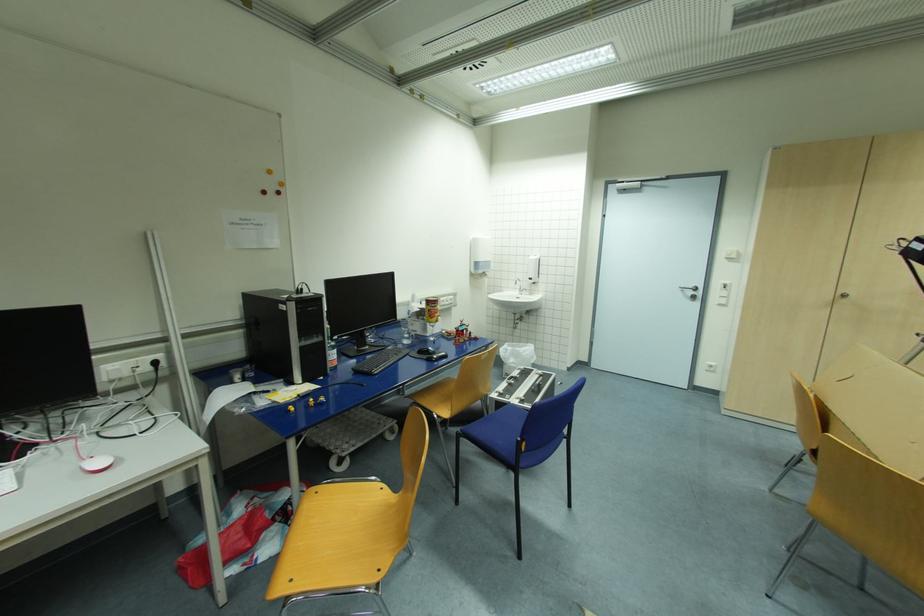
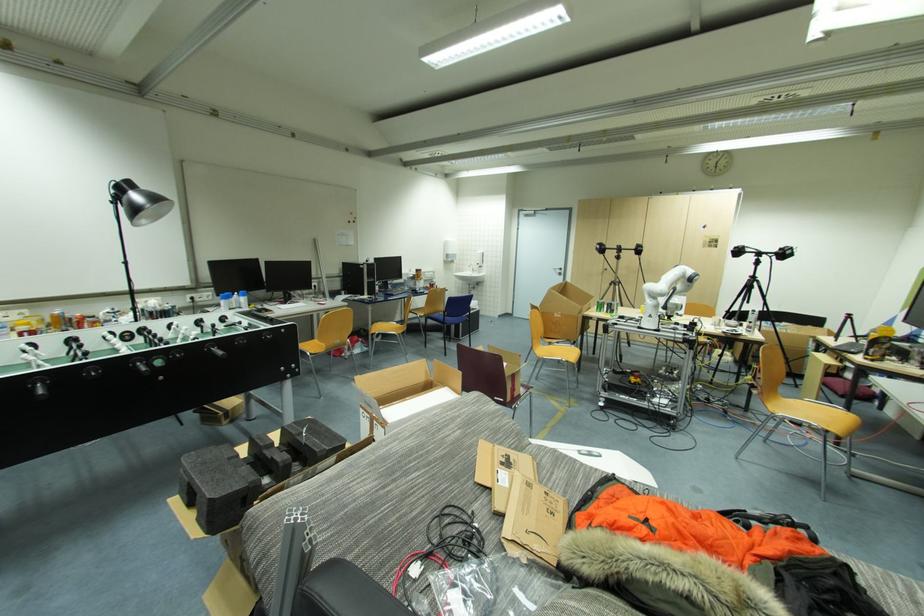
Question: Which direction would the cameraman need to move to produce the second image? Reply with the corresponding letter.

Choices:
 (A) Left
 (B) Right
 (C) Forward
 (D) Backward

Answer: (D)